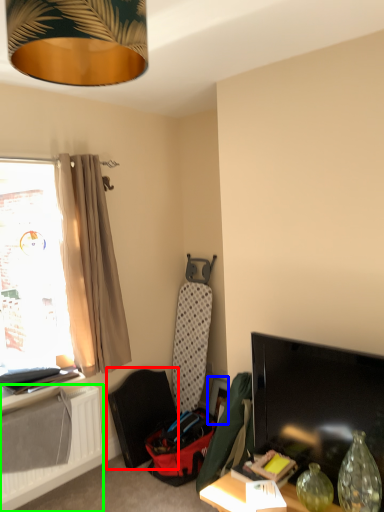
Question: Which object is the closest to the swivel chair (highlighted by a red box)? Choose among these: picture frame (highlighted by a blue box) or radiator (highlighted by a green box).

Choices:
 (A) picture frame
 (B) radiator

Answer: (B)